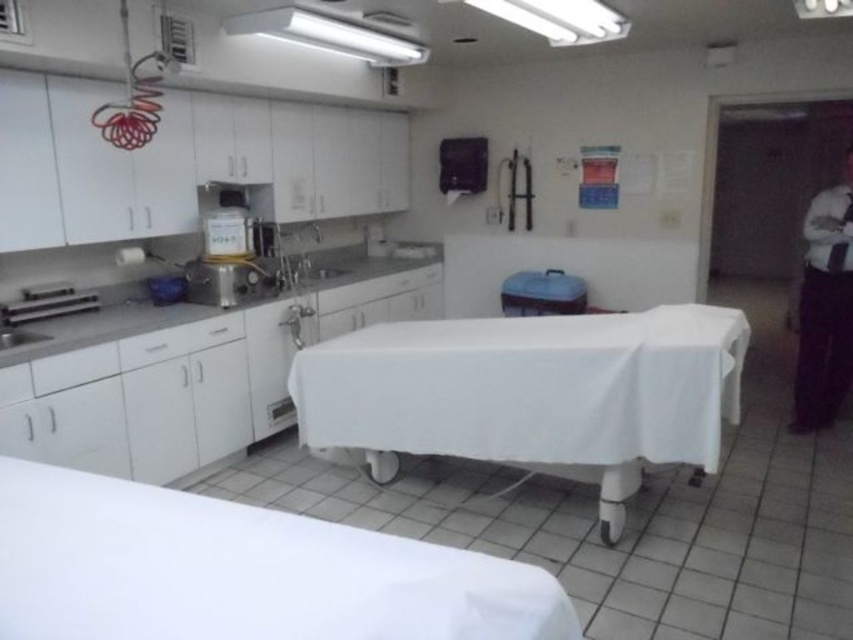
Question: Does white matte tablecloth at center come in front of white plastic exhaust hood at upper center?

Choices:
 (A) yes
 (B) no

Answer: (A)

Question: Which point appears farthest from the camera in this image?

Choices:
 (A) (291, 621)
 (B) (222, 298)

Answer: (B)

Question: Is white plastic exhaust hood at upper center wider than satin silver sink at center-left?

Choices:
 (A) no
 (B) yes

Answer: (B)

Question: Among these points, which one is nearest to the camera?

Choices:
 (A) (625, 381)
 (B) (393, 51)

Answer: (A)

Question: Estimate the real-world distances between objects in this image. Which object is closer to the white matte table at center?

Choices:
 (A) white matte tablecloth at center
 (B) satin silver sink at center-left

Answer: (B)

Question: Does white matte table at center have a smaller size compared to satin silver sink at center-left?

Choices:
 (A) yes
 (B) no

Answer: (B)